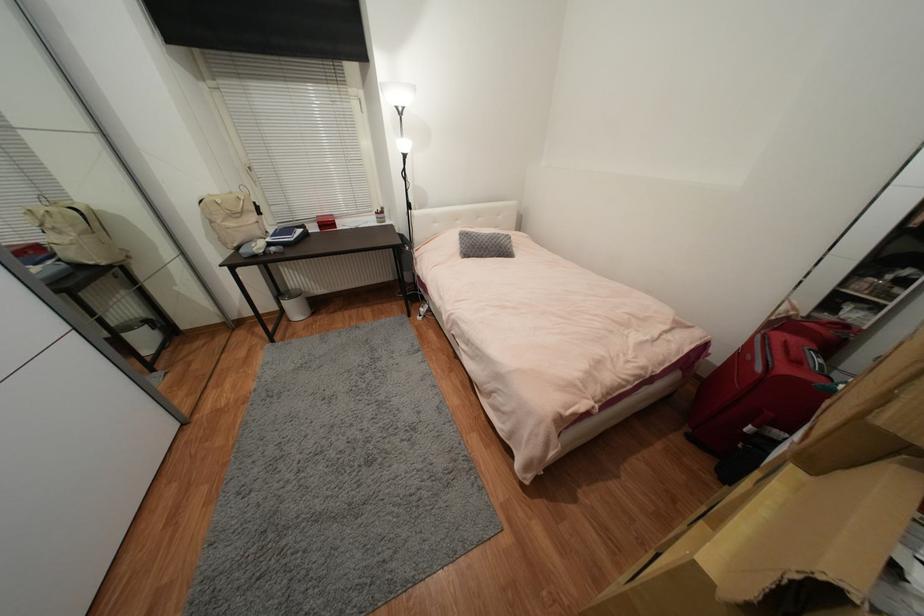
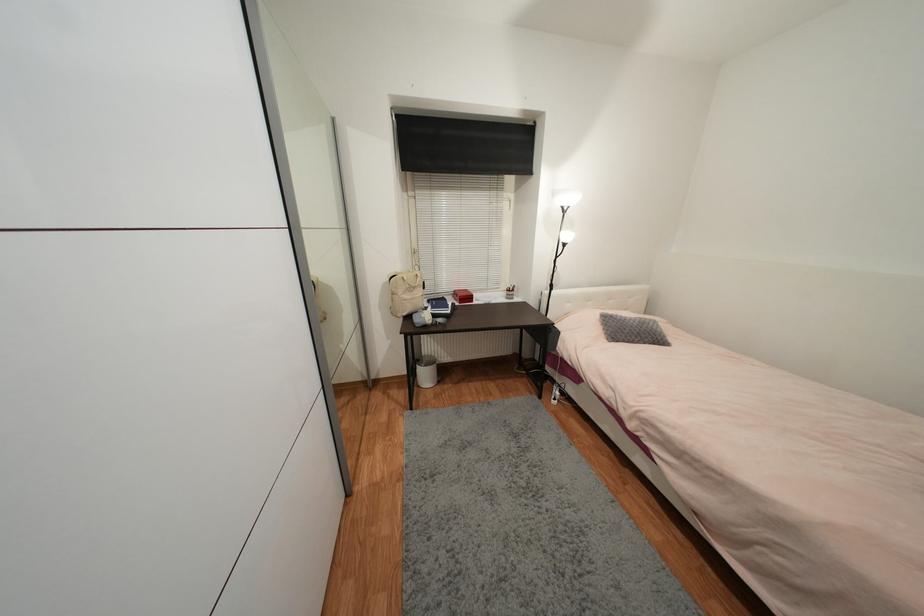
Question: In a continuous first-person perspective shot, in which direction is the camera moving?

Choices:
 (A) Left
 (B) Right
 (C) Forward
 (D) Backward

Answer: (A)